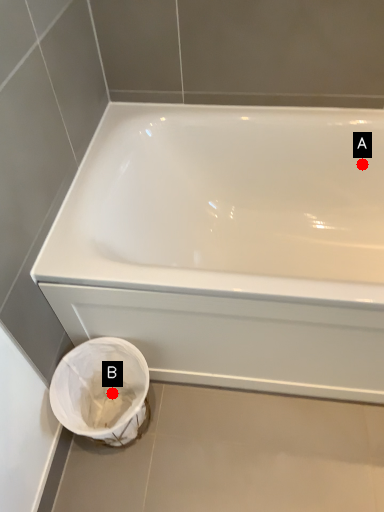
Question: Two points are circled on the image, labeled by A and B beside each circle. Which point appears farthest from the camera in this image?

Choices:
 (A) A is further
 (B) B is further

Answer: (A)